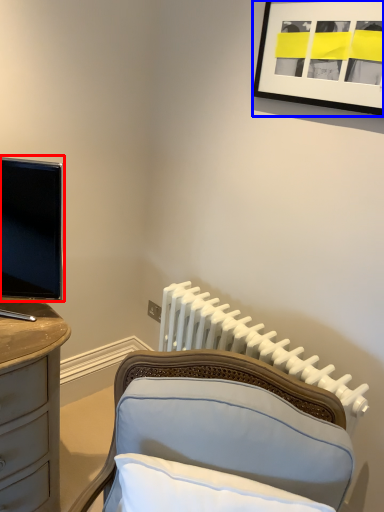
Question: Which object appears closest to the camera in this image, television (highlighted by a red box) or picture frame (highlighted by a blue box)?

Choices:
 (A) television
 (B) picture frame

Answer: (A)